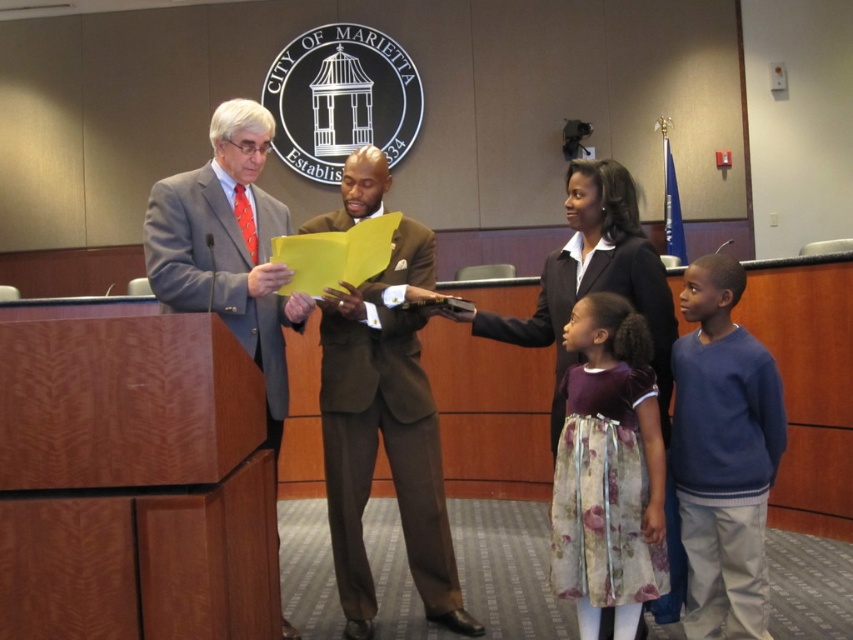
Does brown wool suit at center have a lesser height compared to matte black suit at center?

Incorrect, brown wool suit at center's height does not fall short of matte black suit at center's.

Based on the photo, can you confirm if brown wool suit at center is positioned below matte black suit at center?

No, brown wool suit at center is not below matte black suit at center.

This screenshot has width=853, height=640. Find the location of `brown wool suit at center`. brown wool suit at center is located at coordinates (386, 433).

Can you confirm if blue sweater at right is positioned to the right of matte gray suit at left?

Yes, blue sweater at right is to the right of matte gray suit at left.

Does blue sweater at right have a smaller size compared to matte gray suit at left?

Yes, blue sweater at right is smaller than matte gray suit at left.

Is point (756, 602) in front of point (242, 257)?

Yes, it is in front of point (242, 257).

This screenshot has height=640, width=853. I want to click on blue sweater at right, so click(x=723, y=454).

Does brown wool suit at center have a smaller size compared to matte gray suit at left?

Correct, brown wool suit at center occupies less space than matte gray suit at left.

Can you confirm if brown wool suit at center is positioned to the left of matte gray suit at left?

Incorrect, brown wool suit at center is not on the left side of matte gray suit at left.

Between point (358, 172) and point (206, 305), which one is positioned in front?

Point (206, 305)

The width and height of the screenshot is (853, 640). Find the location of `brown wool suit at center`. brown wool suit at center is located at coordinates (386, 433).